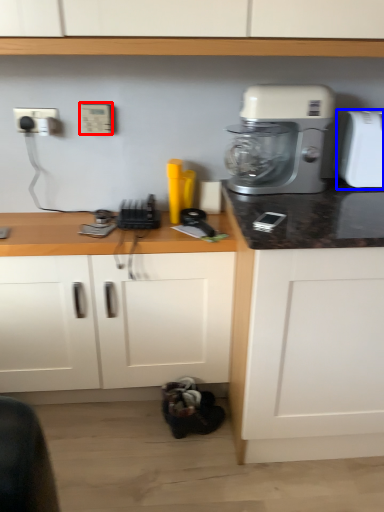
Question: Which object appears farthest to the camera in this image, electric outlet (highlighted by a red box) or toaster (highlighted by a blue box)?

Choices:
 (A) electric outlet
 (B) toaster

Answer: (A)